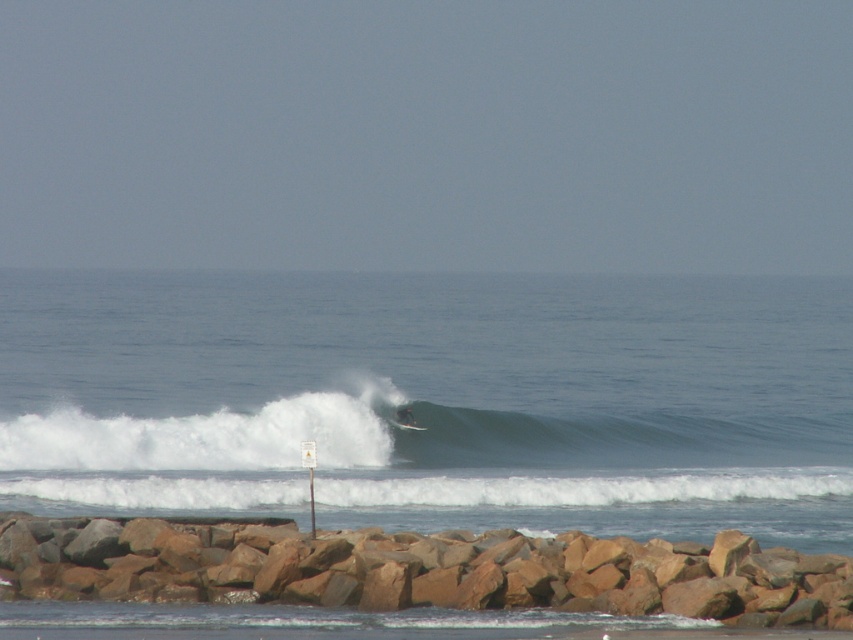
Can you confirm if white foam wave at center is positioned to the left of white foam surfboard at center?

Yes, white foam wave at center is to the left of white foam surfboard at center.

Is white foam wave at center above white foam surfboard at center?

No, white foam wave at center is not above white foam surfboard at center.

Describe the element at coordinates (407, 436) in the screenshot. This screenshot has height=640, width=853. I see `white foam wave at center` at that location.

You are a GUI agent. You are given a task and a screenshot of the screen. Output one action in this format:
    pyautogui.click(x=<x>, y=<y>)
    Task: Click on the white foam wave at center
    The image size is (853, 640).
    Given the screenshot: What is the action you would take?
    407,436

Is white frothy water at center to the right of white foam wave at center from the viewer's perspective?

Correct, you'll find white frothy water at center to the right of white foam wave at center.

Is point (97, 349) less distant than point (558, 464)?

No, (97, 349) is behind (558, 464).

The image size is (853, 640). Describe the element at coordinates (434, 401) in the screenshot. I see `white frothy water at center` at that location.

Where is `white frothy water at center`? This screenshot has width=853, height=640. white frothy water at center is located at coordinates (x=434, y=401).

Is point (316, 589) farther from viewer compared to point (163, 444)?

No, it is in front of (163, 444).

Can you confirm if brown rock at lower center is wider than white foam wave at center?

No.

The image size is (853, 640). Identify the location of brown rock at lower center. (418, 570).